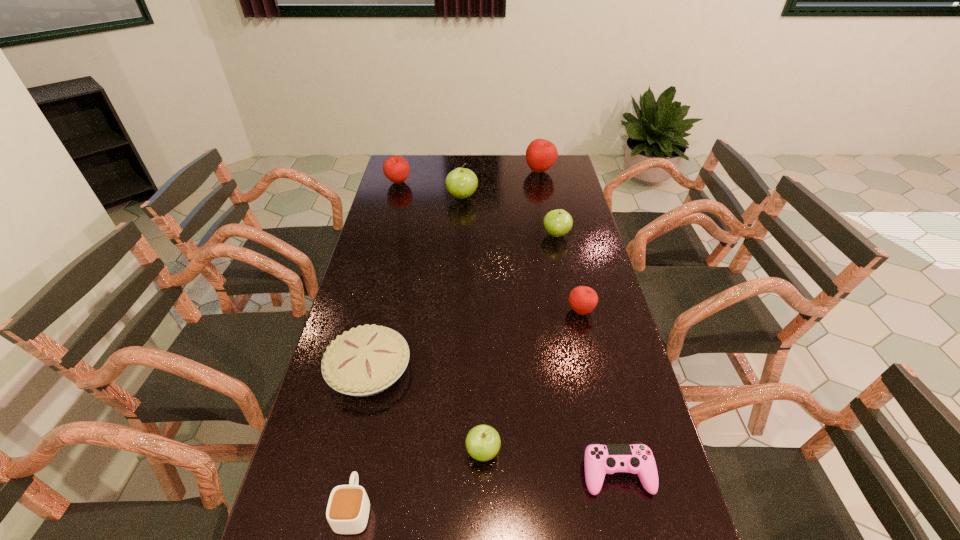
Where is `pie`? The width and height of the screenshot is (960, 540). pie is located at coordinates (366, 360).

Where is `white cup`? Image resolution: width=960 pixels, height=540 pixels. white cup is located at coordinates (348, 508).

Find the location of a particular element. This screenshot has width=960, height=540. pink control is located at coordinates (637, 458).

Identify the location of vacant point located 0.320m on the right of the farthest green apple. (554, 197).

Where is `vacant region located 0.390m on the front of the biggest red apple`? vacant region located 0.390m on the front of the biggest red apple is located at coordinates (552, 231).

Identify the location of vacant space located on the front of the second smallest red apple. This screenshot has height=540, width=960. point(392,207).

Locate an element on the screen. Image resolution: width=960 pixels, height=540 pixels. vacant point located 0.070m on the front of the second smallest green apple is located at coordinates (561, 255).

This screenshot has width=960, height=540. Find the location of `vacant space located 0.340m on the left of the fifth farthest apple`. vacant space located 0.340m on the left of the fifth farthest apple is located at coordinates (458, 310).

This screenshot has width=960, height=540. In order to click on vacant space located on the left of the nearest apple in this screenshot , I will do `click(419, 451)`.

Locate an element on the screen. The width and height of the screenshot is (960, 540). free point located 0.060m on the back of the sixth farthest object is located at coordinates (380, 322).